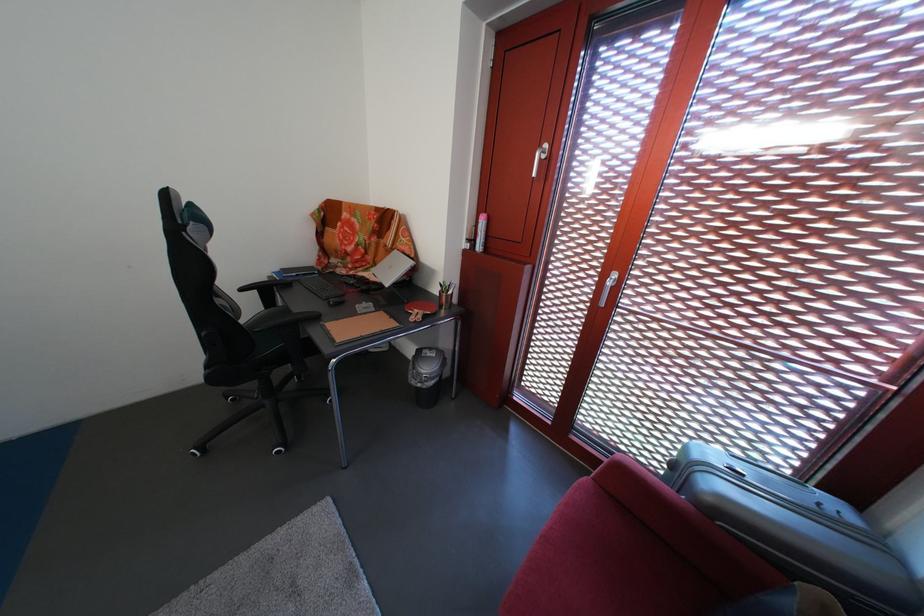
The image size is (924, 616). What do you see at coordinates (676, 520) in the screenshot?
I see `the red sofa armrest` at bounding box center [676, 520].